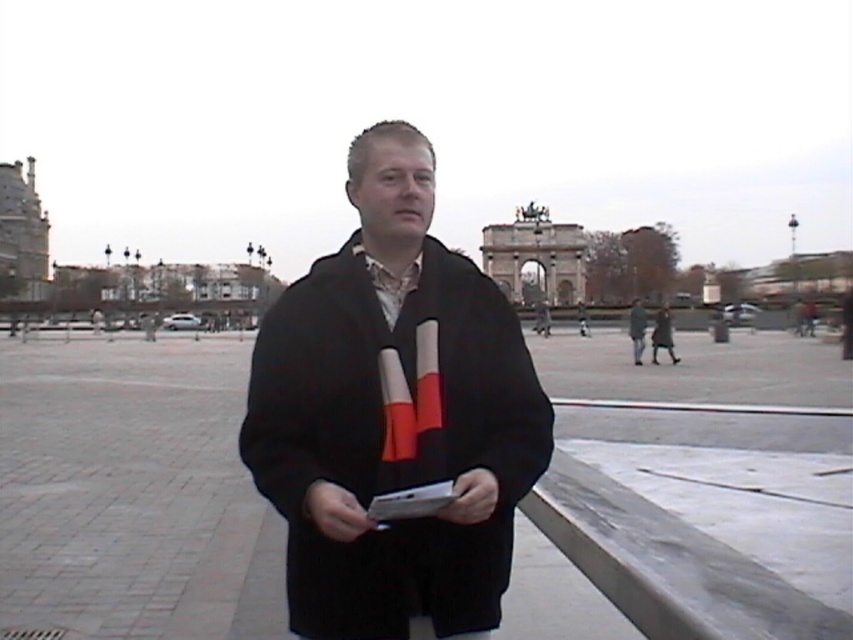
Is brick pavement at center wider than dark gray wool coat at center?

Correct, the width of brick pavement at center exceeds that of dark gray wool coat at center.

Is point (683, 513) in front of point (633, 326)?

That is True.

In order to click on brick pavement at center in this screenshot , I will do `click(132, 492)`.

What are the coordinates of `black wool scarf at center` in the screenshot? It's located at (393, 417).

Is point (310, 356) farther from camera compared to point (637, 346)?

No.

At what (x,y) coordinates should I click in order to perform the action: click on black wool scarf at center. Please return your answer as a coordinate pair (x, y). The image size is (853, 640). Looking at the image, I should click on (393, 417).

Can you confirm if brick pavement at center is wider than black wool scarf at center?

Yes.

Can you confirm if brick pavement at center is positioned to the left of black wool scarf at center?

Incorrect, brick pavement at center is not on the left side of black wool scarf at center.

Image resolution: width=853 pixels, height=640 pixels. In order to click on brick pavement at center in this screenshot , I will do `click(132, 492)`.